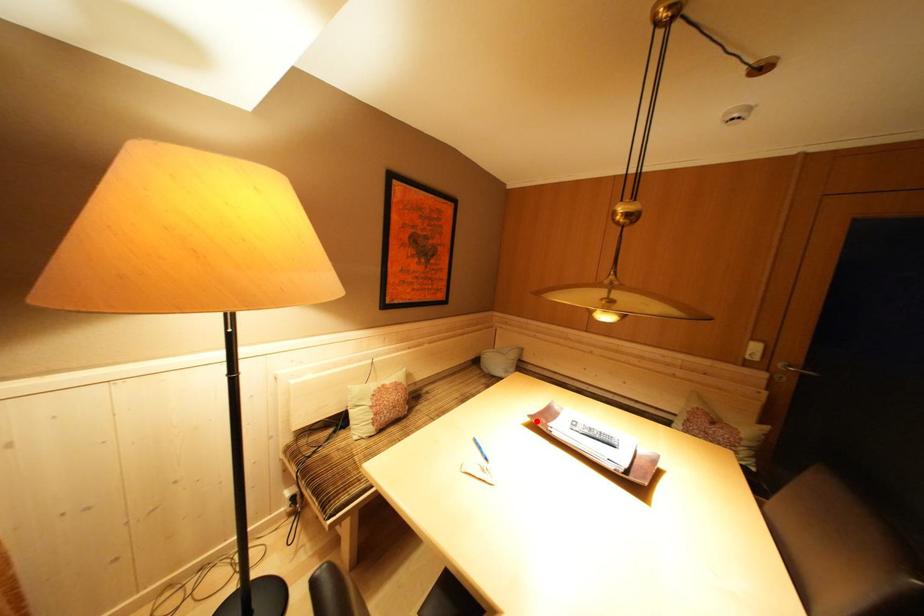
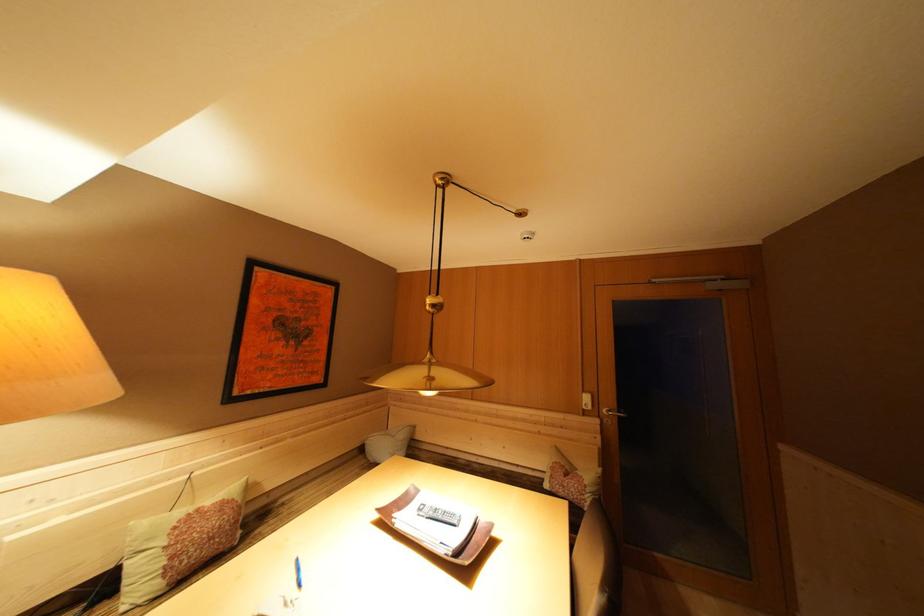
Find the pixel in the second image that matches the highlighted location in the first image.

(384, 515)